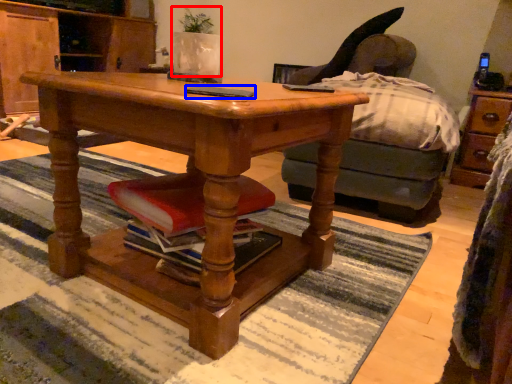
Question: Which point is further to the camera, houseplant (highlighted by a red box) or mobile phone (highlighted by a blue box)?

Choices:
 (A) houseplant
 (B) mobile phone

Answer: (A)